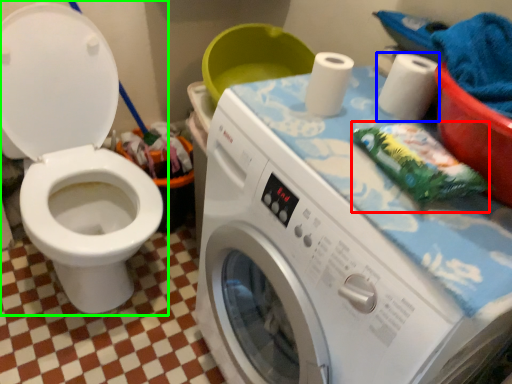
Question: Which object is positioned closest to material (highlighted by a red box)? Select from toilet paper (highlighted by a blue box) and toilet (highlighted by a green box).

Choices:
 (A) toilet paper
 (B) toilet

Answer: (A)